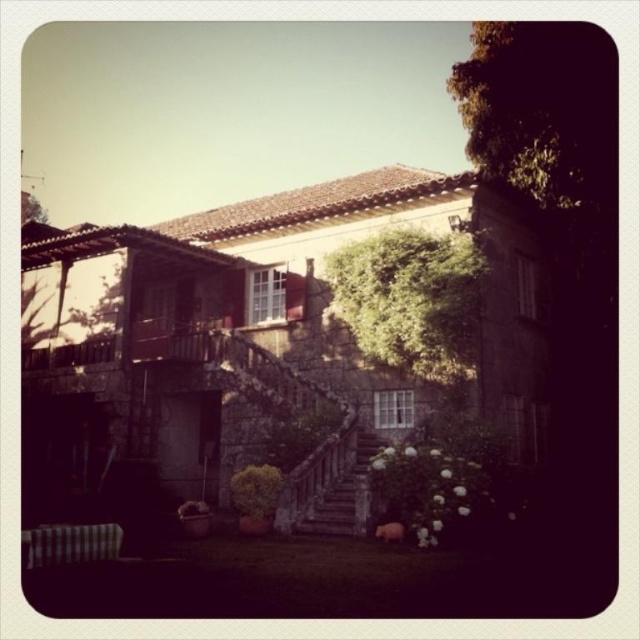
You are standing at the base of the stone stairs leading to the house entrance. There are two sets of stairs mentioned here, the stone textured stairs at center and the rustic stone stairs at center. Which set of stairs is closer to you?

The stone textured stairs at center are closer to you since the rustic stone stairs at center are positioned behind them.

You are a delivery person carrying a large package that is 2 meters wide. You need to walk up the stairs to deliver it to the house. Which stairs should you take to ensure the package fits through the path between the stone textured stairs at center and rustic stone stairs at center?

The stone textured stairs at center has a larger width than the rustic stone stairs at center, so you should take the stone textured stairs at center to ensure the package fits through the path.

You are a delivery person carrying a large package and need to approach the entrance of the stone house. You see the stone textured stairs at center and the rustic stone stairs at center. Which path should you take to avoid the gap between them?

The stone textured stairs at center and rustic stone stairs at center are 68.02 centimeters apart from each other, so you should choose either one to avoid the gap between them since they are separate structures.